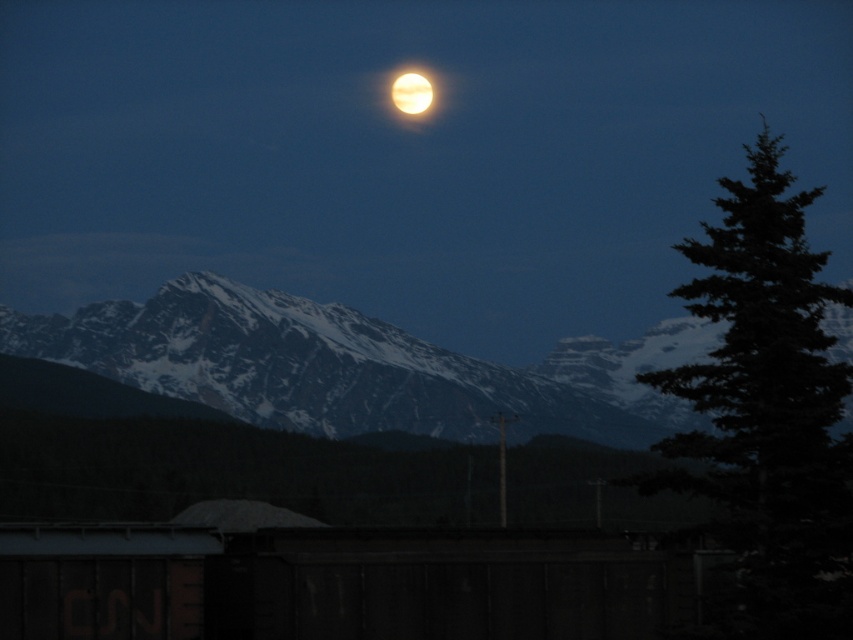
From the picture: You are an astronaut on the moon looking back at Earth. You see the snowy rock mountain range at center and the green textured tree at right in the Earth image. Which object appears taller in Earth?

The green textured tree at right appears taller than the snowy rock mountain range at center in the Earth image.

You are standing in the night scene looking at the full moon. There are two points marked in the image. Point A is at coordinates point (x=265, y=332) and Point B is at point (x=399, y=72). Which point is closer to you?

Point A at point (x=265, y=332) is closer to you because it is in front of point (x=399, y=72).